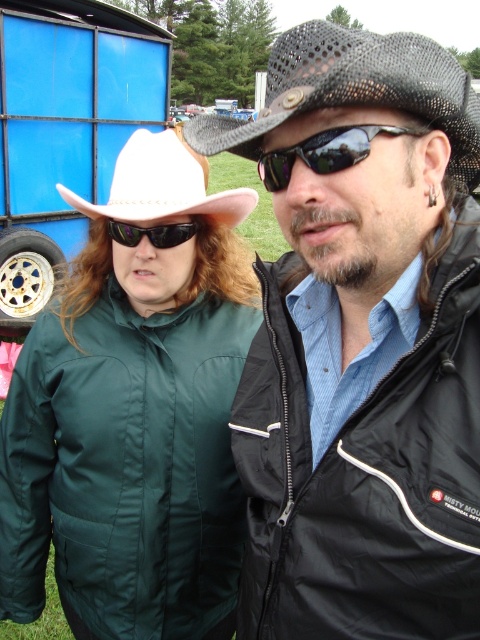
You are a photographer trying to capture a candid shot of the two people in the scene. You notice the green matte jacket at center and the sunglasses at center. Which object should you focus on first if you want to photograph the person on the left?

The green matte jacket at center is to the left of the sunglasses at center, so you should focus on the green matte jacket at center first to capture the person on the left.

You are trying to decide whether to place a rectangular box that is 1 foot wide on a surface between the green matte jacket at center and the white felt cowboy hat at upper left. Based on their widths, can the box fit between them?

The green matte jacket at center might be wider than the white felt cowboy hat at upper left, so the box might not fit between them if the jacket is wider. However, since the exact width difference isn not specified, it is uncertain.